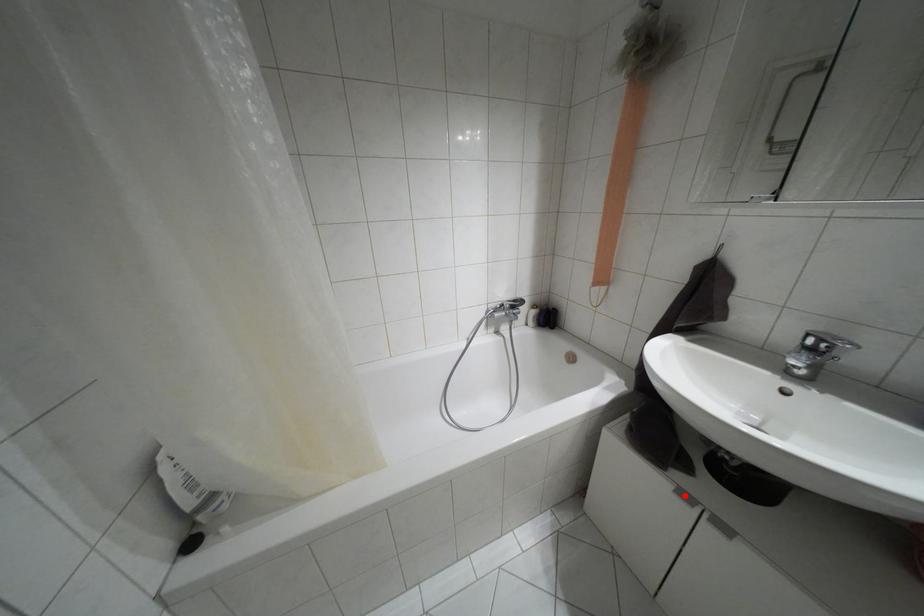
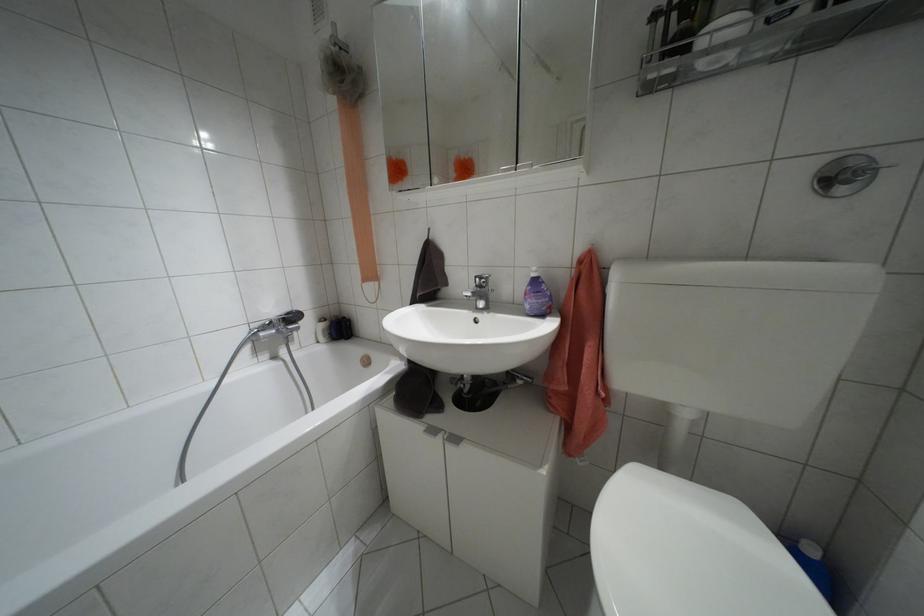
Where in the second image is the point corresponding to the highlighted location from the first image?

(432, 430)